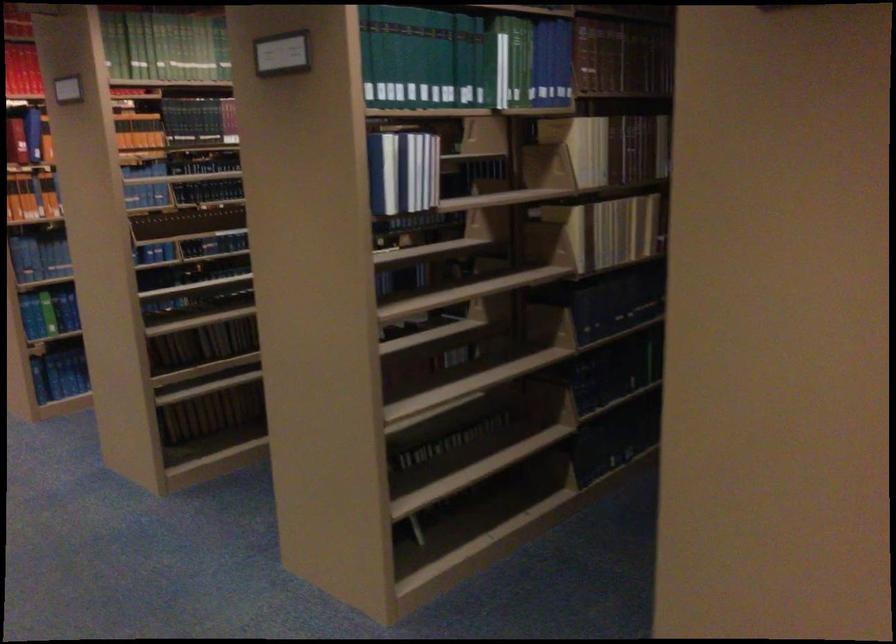
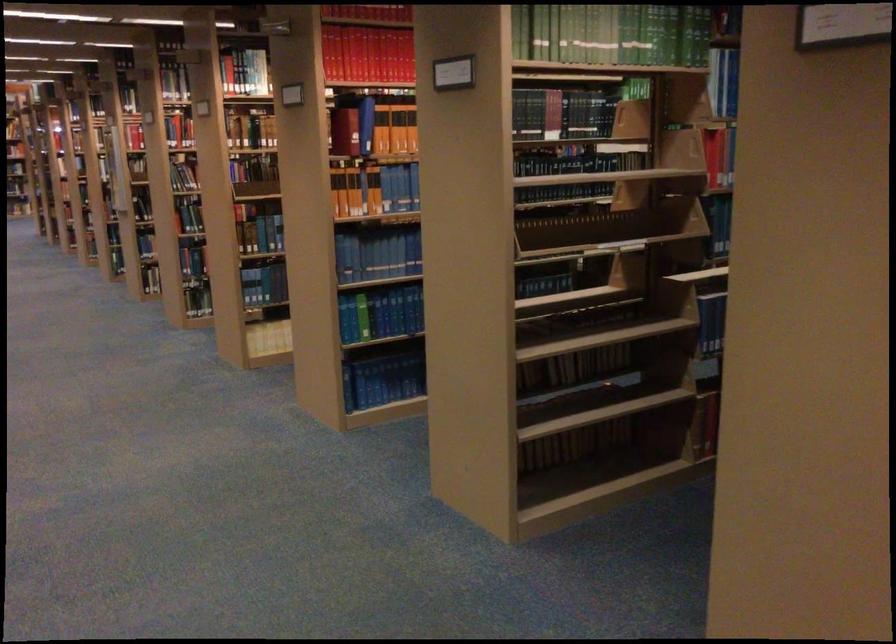
Locate, in the second image, the point that corresponds to point 74,381 in the first image.

(383, 380)